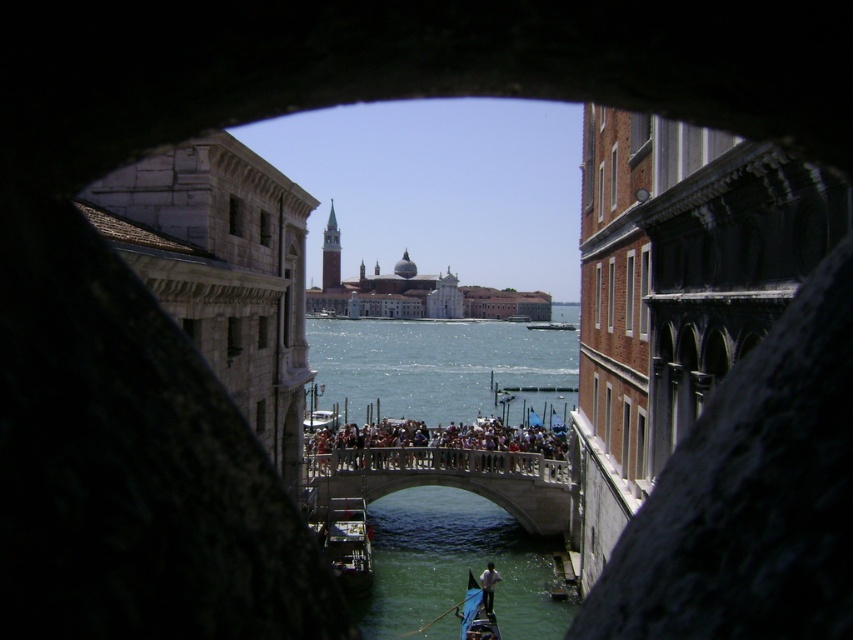
Question: Among these objects, which one is nearest to the camera?

Choices:
 (A) dark gray concrete bridge at center
 (B) white fabric shirt at lower center
 (C) metallic polished boat at center
 (D) stone bridge at center

Answer: (B)

Question: Is wooden gondola at lower center to the right of white fabric shirt at lower center from the viewer's perspective?

Choices:
 (A) yes
 (B) no

Answer: (B)

Question: Does stone bridge at center appear over dark gray concrete bridge at center?

Choices:
 (A) yes
 (B) no

Answer: (B)

Question: Based on their relative distances, which object is nearer to the metallic polished boat at center?

Choices:
 (A) wooden gondola at lower center
 (B) dark gray concrete bridge at center
 (C) stone bridge at center
 (D) white fabric shirt at lower center

Answer: (C)

Question: Does dark gray concrete bridge at center lie behind metallic polished boat at center?

Choices:
 (A) yes
 (B) no

Answer: (A)

Question: Based on their relative distances, which object is farther from the metallic polished boat at center?

Choices:
 (A) stone bridge at center
 (B) dark gray concrete bridge at center

Answer: (B)